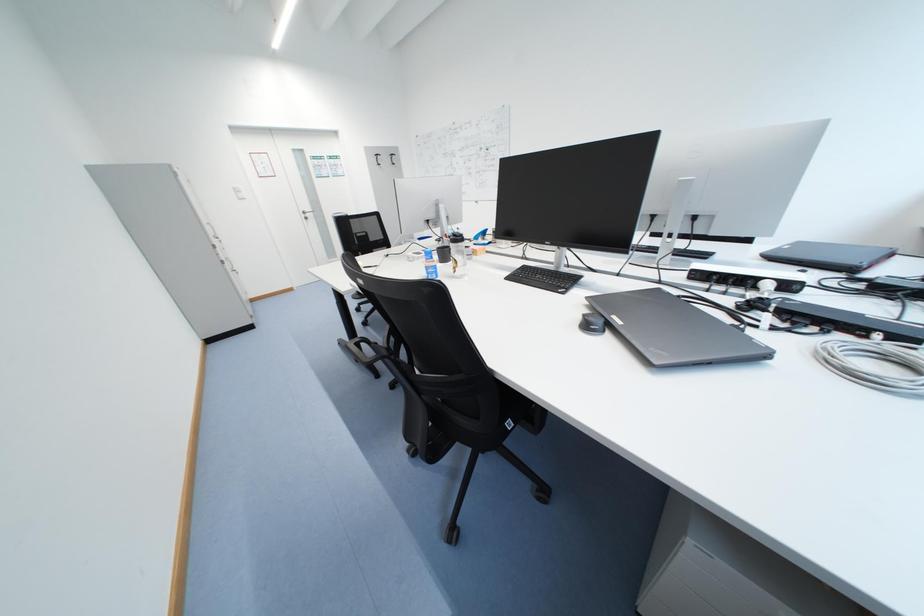
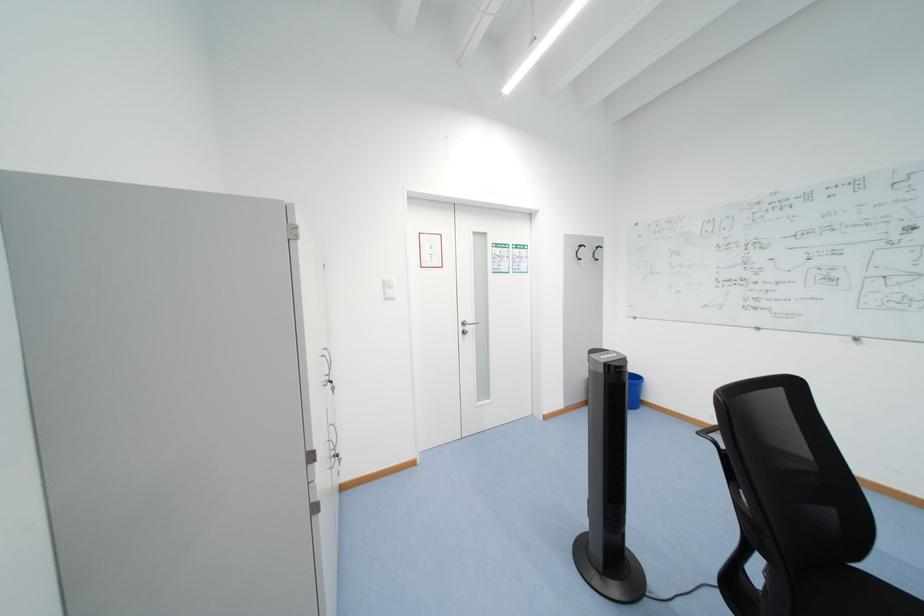
What movement of the cameraman would produce the second image?

The cameraman walked toward left, forward.